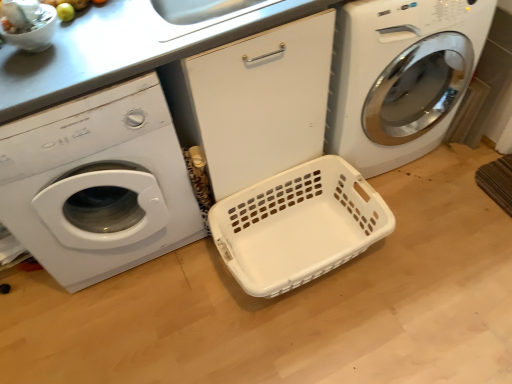
Question: From a real-world perspective, is white plastic washing machine at left, which is the 1th washing machine from left to right, positioned above or below white glossy washing machine at center, marked as the 1th washing machine in a right-to-left arrangement?

Choices:
 (A) below
 (B) above

Answer: (B)

Question: Considering the positions of white plastic washing machine at left, the second washing machine from the right, and white glossy washing machine at center, marked as the 1th washing machine in a right-to-left arrangement, in the image, is white plastic washing machine at left, the second washing machine from the right, bigger or smaller than white glossy washing machine at center, marked as the 1th washing machine in a right-to-left arrangement,?

Choices:
 (A) small
 (B) big

Answer: (A)

Question: Which object is positioned closest to the white glossy washing machine at center, the 2th washing machine viewed from the left?

Choices:
 (A) white plastic washing machine at left, which is the 1th washing machine from left to right
 (B) white plastic basket at center

Answer: (B)

Question: Considering the real-world distances, which object is farthest from the white plastic basket at center?

Choices:
 (A) white plastic washing machine at left, which is the 1th washing machine from left to right
 (B) white glossy washing machine at center, the 2th washing machine viewed from the left

Answer: (A)